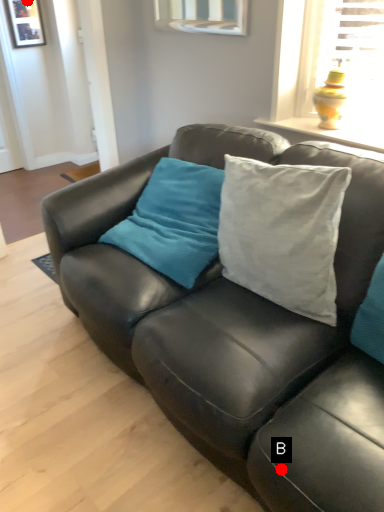
Question: Two points are circled on the image, labeled by A and B beside each circle. Among these points, which one is nearest to the camera?

Choices:
 (A) A is closer
 (B) B is closer

Answer: (B)